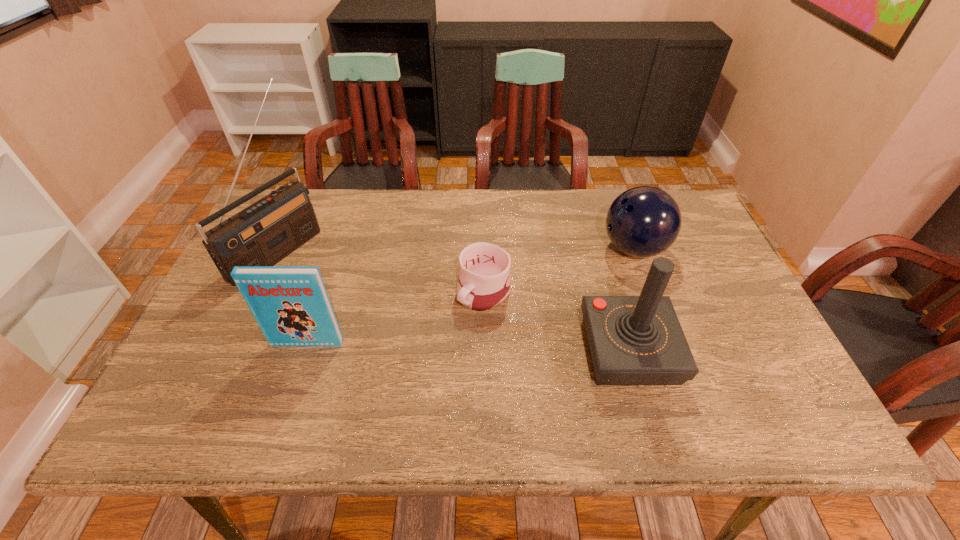
Find the location of a particular element. The width and height of the screenshot is (960, 540). vacant spot on the desktop that is between the third tallest object and the joystick and is positioned on the front-facing side of the tallest object is located at coordinates (456, 346).

Locate an element on the screen. This screenshot has width=960, height=540. vacant space on the desktop that is between the book and the joystick and is positioned on the surface of the fourth tallest object near the finger holes is located at coordinates (433, 346).

At what (x,y) coordinates should I click in order to perform the action: click on vacant space on the desktop that is between the third shortest object and the joystick and is positioned on the side with the handle of the mug. Please return your answer as a coordinate pair (x, y). Looking at the image, I should click on (425, 346).